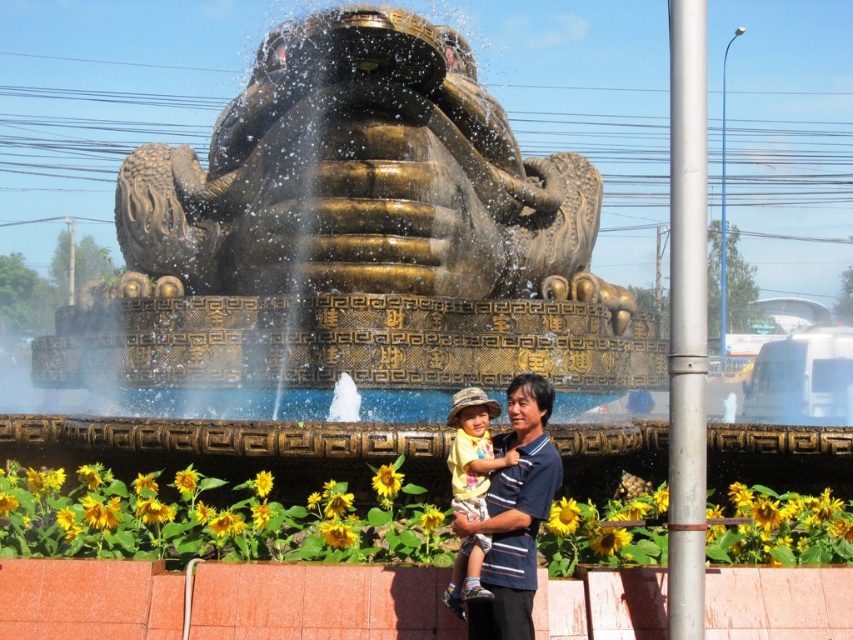
Question: Which point appears farthest from the camera in this image?

Choices:
 (A) (228, 305)
 (B) (479, 448)

Answer: (A)

Question: Can you confirm if gold polished statue at center is positioned to the right of yellow cotton shirt at center?

Choices:
 (A) yes
 (B) no

Answer: (B)

Question: Does gold polished statue at center have a greater width compared to yellow cotton shirt at center?

Choices:
 (A) no
 (B) yes

Answer: (B)

Question: Is gold polished statue at center wider than yellow cotton shirt at center?

Choices:
 (A) yes
 (B) no

Answer: (A)